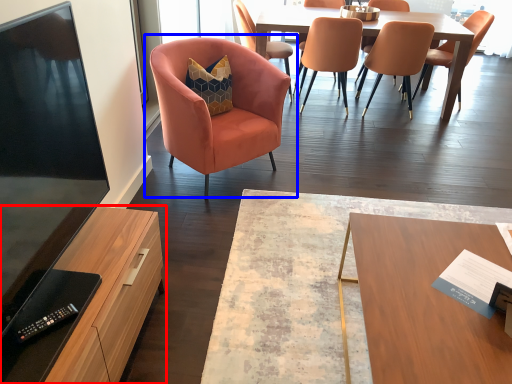
Question: Among these objects, which one is nearest to the camera, cabinetry (highlighted by a red box) or chair (highlighted by a blue box)?

Choices:
 (A) cabinetry
 (B) chair

Answer: (A)